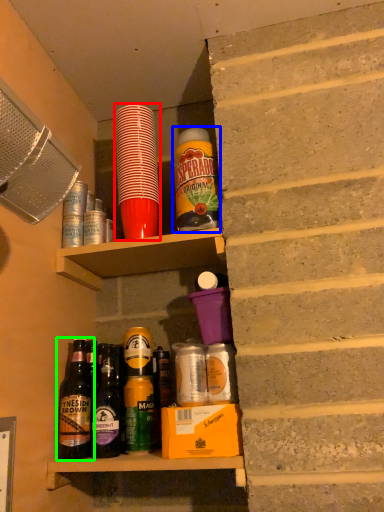
Question: Estimate the real-world distances between objects in this image. Which object is closer to bottle (highlighted by a red box), bottle (highlighted by a blue box) or bottle (highlighted by a green box)?

Choices:
 (A) bottle
 (B) bottle

Answer: (A)